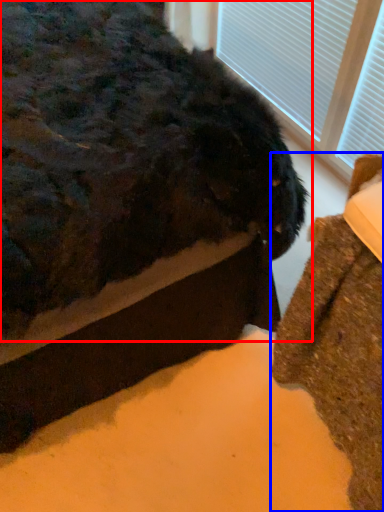
Question: Which object appears farthest to the camera in this image, animal (highlighted by a red box) or furniture (highlighted by a blue box)?

Choices:
 (A) animal
 (B) furniture

Answer: (B)